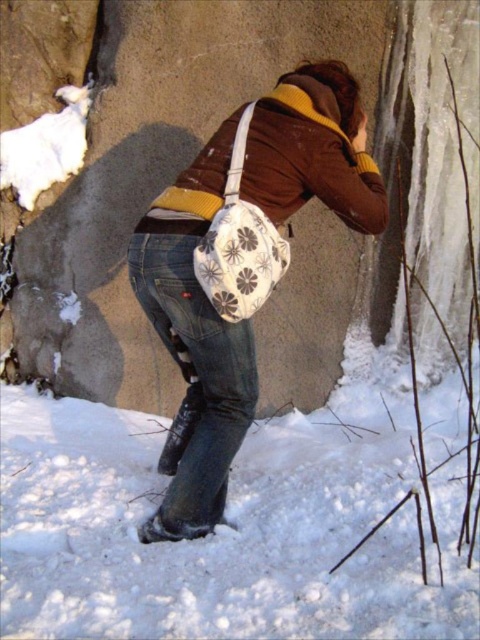
Is white fluffy snow at lower left to the left of brown matte jacket at center from the viewer's perspective?

Yes, white fluffy snow at lower left is to the left of brown matte jacket at center.

Is white fluffy snow at lower left above brown matte jacket at center?

No.

What do you see at coordinates (226, 528) in the screenshot? I see `white fluffy snow at lower left` at bounding box center [226, 528].

Locate an element on the screen. The image size is (480, 640). white fluffy snow at lower left is located at coordinates point(226,528).

Between point (163, 205) and point (188, 208), which one is positioned behind?

Point (163, 205)

Between point (162, 232) and point (264, 180), which one is positioned in front?

Point (162, 232)

Identify the location of floral fabric bag at center. (193, 346).

Is white fluffy snow at lower left to the left of floral fabric bag at center from the viewer's perspective?

Correct, you'll find white fluffy snow at lower left to the left of floral fabric bag at center.

Is white fluffy snow at lower left thinner than floral fabric bag at center?

No, white fluffy snow at lower left is not thinner than floral fabric bag at center.

At what (x,y) coordinates should I click in order to perform the action: click on white fluffy snow at lower left. Please return your answer as a coordinate pair (x, y). The height and width of the screenshot is (640, 480). Looking at the image, I should click on (226, 528).

This screenshot has height=640, width=480. I want to click on white fluffy snow at lower left, so click(x=226, y=528).